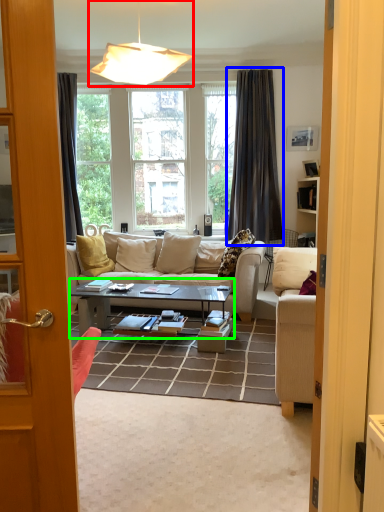
Question: Which is nearer to the lamp (highlighted by a red box)? curtain (highlighted by a blue box) or coffee table (highlighted by a green box).

Choices:
 (A) curtain
 (B) coffee table

Answer: (B)